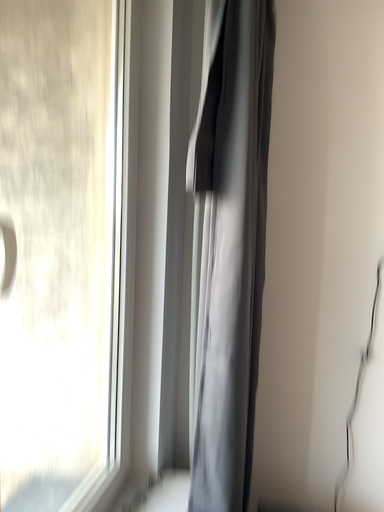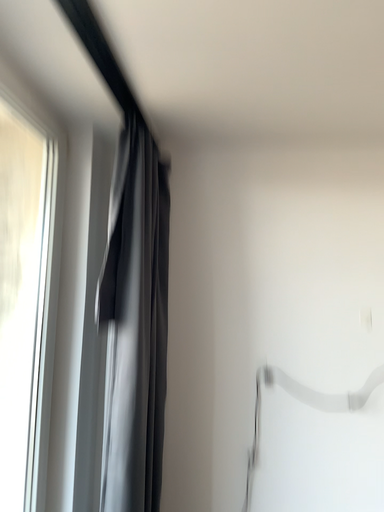
Question: Which way did the camera rotate in the video?

Choices:
 (A) rotated right
 (B) rotated left

Answer: (A)